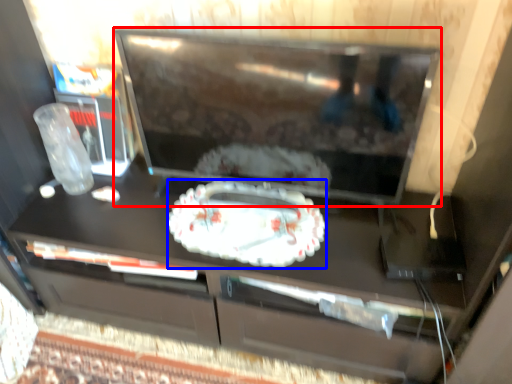
Question: Which point is further to the camera, television (highlighted by a red box) or cake (highlighted by a blue box)?

Choices:
 (A) television
 (B) cake

Answer: (B)